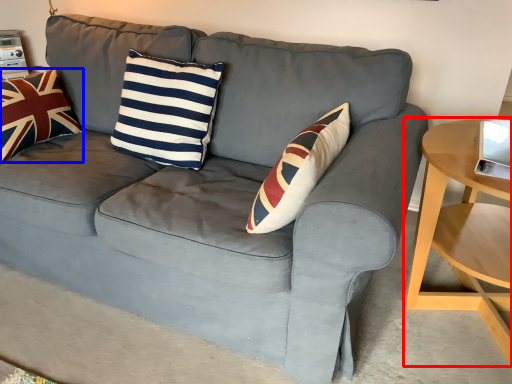
Question: Which object is closer to the camera taking this photo, table (highlighted by a red box) or pillow (highlighted by a blue box)?

Choices:
 (A) table
 (B) pillow

Answer: (A)